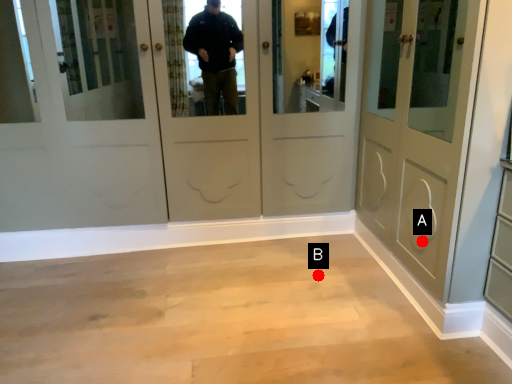
Question: Two points are circled on the image, labeled by A and B beside each circle. Which point is farther from the camera taking this photo?

Choices:
 (A) A is further
 (B) B is further

Answer: (B)